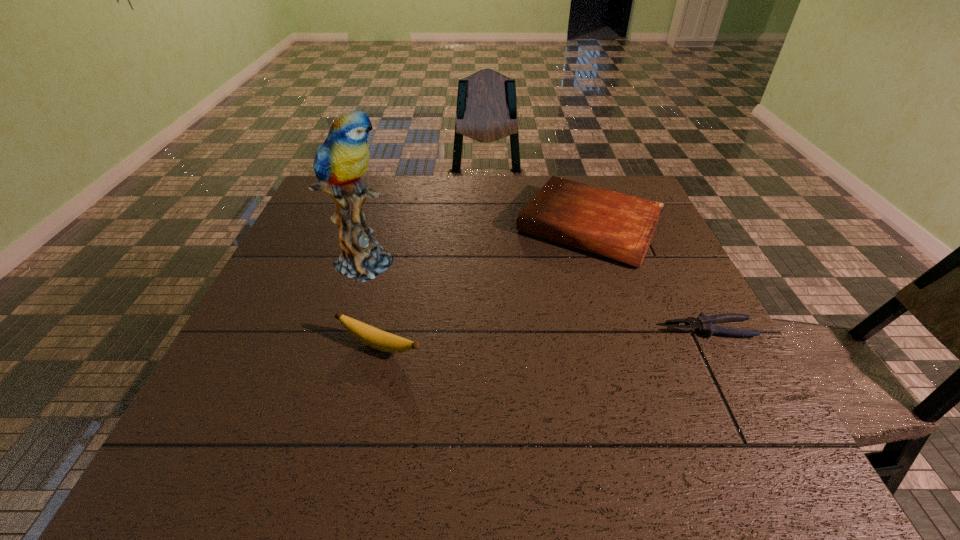
Locate an element on the screen. The image size is (960, 540). vacant area situated 0.240m on the spine side of the Bible is located at coordinates (522, 325).

Image resolution: width=960 pixels, height=540 pixels. I want to click on free space located 0.330m on the face of the parrot, so click(x=512, y=310).

In order to click on vacant area located 0.050m on the face of the parrot in this screenshot , I will do `click(409, 275)`.

Locate an element on the screen. free space located 0.210m on the face of the parrot is located at coordinates (466, 294).

Image resolution: width=960 pixels, height=540 pixels. I want to click on object at the far edge, so click(x=618, y=226).

Locate an element on the screen. Image resolution: width=960 pixels, height=540 pixels. object situated at the left edge is located at coordinates (340, 161).

The width and height of the screenshot is (960, 540). What are the coordinates of `pliers situated at the right edge` in the screenshot? It's located at [705, 324].

The width and height of the screenshot is (960, 540). In order to click on Bible that is at the right edge in this screenshot , I will do `click(618, 226)`.

Find the location of a particular element. object that is at the far right corner is located at coordinates (618, 226).

Where is `vacant space at the far edge`? Image resolution: width=960 pixels, height=540 pixels. vacant space at the far edge is located at coordinates (525, 199).